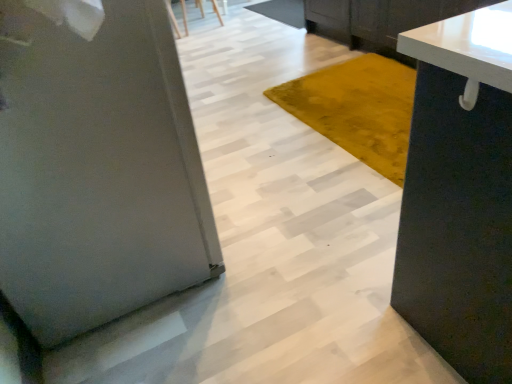
Question: Can you confirm if white glossy countertop at upper right is thinner than wooden chair at upper center?

Choices:
 (A) yes
 (B) no

Answer: (B)

Question: Does white glossy countertop at upper right have a smaller size compared to wooden chair at upper center?

Choices:
 (A) no
 (B) yes

Answer: (A)

Question: Would you consider white glossy countertop at upper right to be distant from wooden chair at upper center?

Choices:
 (A) no
 (B) yes

Answer: (B)

Question: From the image's perspective, is white glossy countertop at upper right beneath wooden chair at upper center?

Choices:
 (A) yes
 (B) no

Answer: (A)

Question: Is white glossy countertop at upper right to the right of wooden chair at upper center from the viewer's perspective?

Choices:
 (A) yes
 (B) no

Answer: (A)

Question: In the image, is satin silver refrigerator at left positioned in front of or behind matte black cabinet at right?

Choices:
 (A) front
 (B) behind

Answer: (B)

Question: Is satin silver refrigerator at left inside the boundaries of matte black cabinet at right, or outside?

Choices:
 (A) inside
 (B) outside

Answer: (B)

Question: In terms of width, does satin silver refrigerator at left look wider or thinner when compared to matte black cabinet at right?

Choices:
 (A) thin
 (B) wide

Answer: (B)

Question: Is satin silver refrigerator at left taller or shorter than matte black cabinet at right?

Choices:
 (A) tall
 (B) short

Answer: (A)

Question: Considering their positions, is white glossy countertop at upper right located in front of or behind satin silver refrigerator at left?

Choices:
 (A) front
 (B) behind

Answer: (B)

Question: From the image's perspective, is white glossy countertop at upper right located above or below satin silver refrigerator at left?

Choices:
 (A) below
 (B) above

Answer: (B)

Question: Looking at their shapes, would you say white glossy countertop at upper right is wider or thinner than satin silver refrigerator at left?

Choices:
 (A) thin
 (B) wide

Answer: (A)

Question: Considering the positions of white glossy countertop at upper right and satin silver refrigerator at left in the image, is white glossy countertop at upper right taller or shorter than satin silver refrigerator at left?

Choices:
 (A) tall
 (B) short

Answer: (B)

Question: In terms of size, does matte black cabinet at right appear bigger or smaller than satin silver refrigerator at left?

Choices:
 (A) big
 (B) small

Answer: (B)

Question: Is matte black cabinet at right to the left or to the right of satin silver refrigerator at left in the image?

Choices:
 (A) left
 (B) right

Answer: (B)